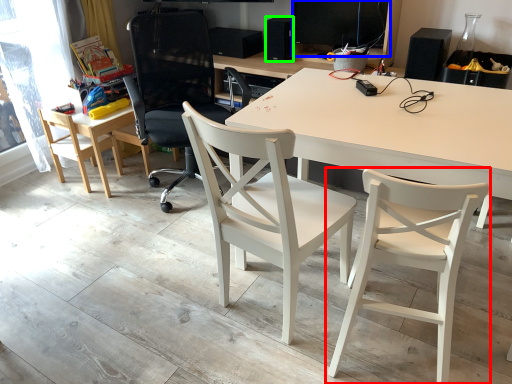
Question: Considering the real-world distances, which object is farthest from chair (highlighted by a red box)? computer monitor (highlighted by a blue box) or speaker (highlighted by a green box)?

Choices:
 (A) computer monitor
 (B) speaker

Answer: (B)